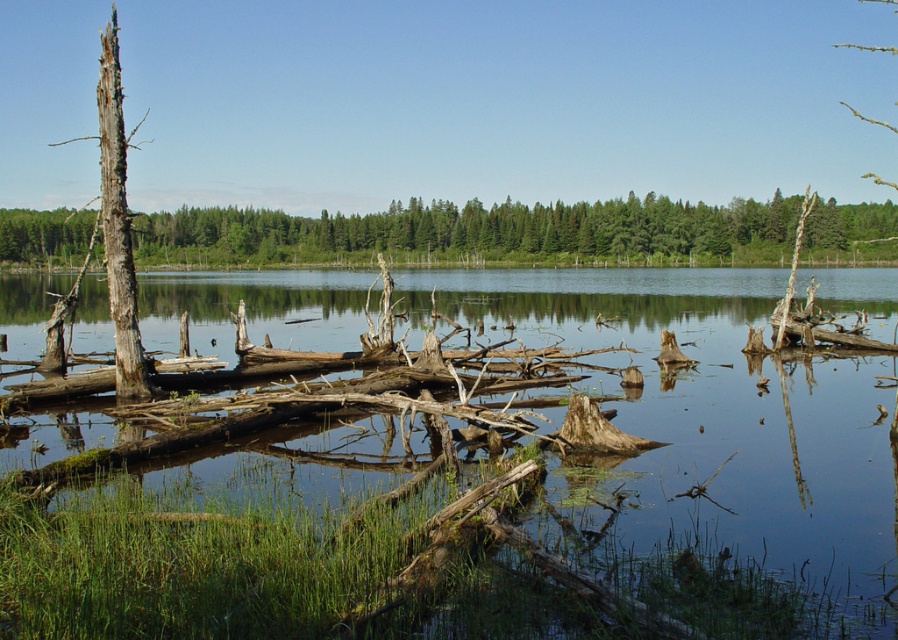
You are a kayaker planning to paddle from the dead wood at left to the clear water at center. The kayak requires a minimum of 40 meters of open water to safely navigate. Based on the scene, can you safely make this journey?

The clear water at center and dead wood at left are 39.61 meters apart from each other. Since the kayak requires a minimum of 40 meters of open water to safely navigate, the distance is insufficient. Therefore, the journey cannot be made safely.

You are standing on the bank of the lake and want to cross to the other side. You see clear water at center and dead wood at left. Which one is closer to your current position?

The dead wood at left is closer to your current position because it is to the left of the clear water at center.